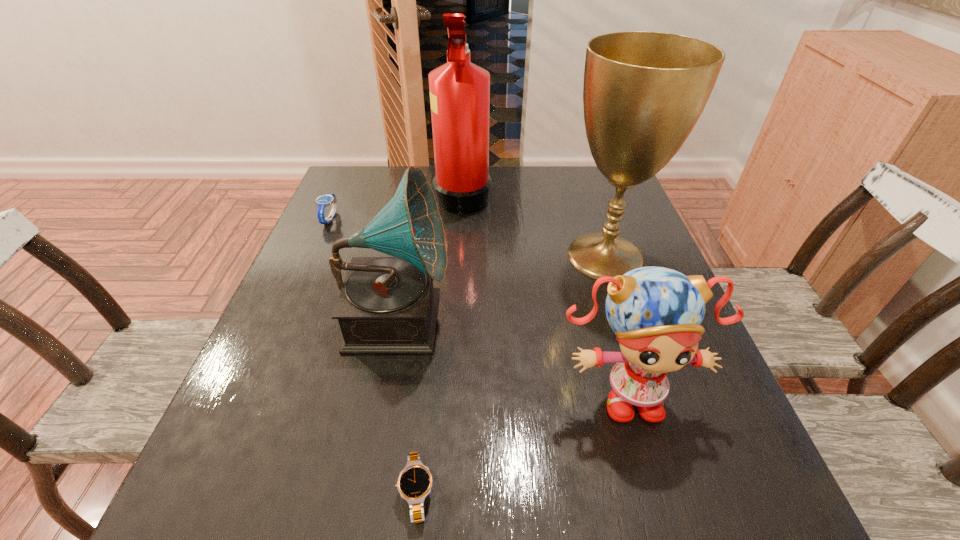
Image resolution: width=960 pixels, height=540 pixels. What are the coordinates of `free location located 0.320m on the left of the trophy cup` in the screenshot? It's located at (425, 256).

You are a GUI agent. You are given a task and a screenshot of the screen. Output one action in this format:
    pyautogui.click(x=<x>, y=<y>)
    Task: Click on the vacant space located 0.270m on the horn of the fourth shortest object
    The height and width of the screenshot is (540, 960).
    Given the screenshot: What is the action you would take?
    (580, 315)

I want to click on blank space located on the face of the doll, so click(665, 530).

Where is `free space located 0.190m on the right of the leftmost object`? free space located 0.190m on the right of the leftmost object is located at coordinates (410, 219).

Image resolution: width=960 pixels, height=540 pixels. Find the location of `free space located on the left of the right watch`. free space located on the left of the right watch is located at coordinates (276, 492).

Identify the location of fire extinguisher at the far edge. (459, 90).

This screenshot has height=540, width=960. In order to click on watch that is at the far edge in this screenshot , I will do `click(322, 201)`.

Find the location of `object present at the near edge`. object present at the near edge is located at coordinates (414, 484).

This screenshot has height=540, width=960. I want to click on record player that is at the left edge, so click(387, 305).

Locate an element on the screen. The height and width of the screenshot is (540, 960). watch present at the left edge is located at coordinates (322, 201).